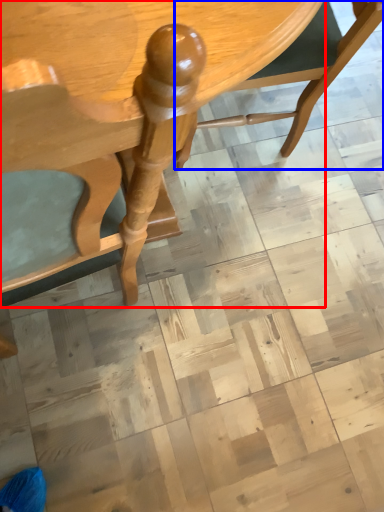
Question: Among these objects, which one is nearest to the camera, table (highlighted by a red box) or chair (highlighted by a blue box)?

Choices:
 (A) table
 (B) chair

Answer: (A)